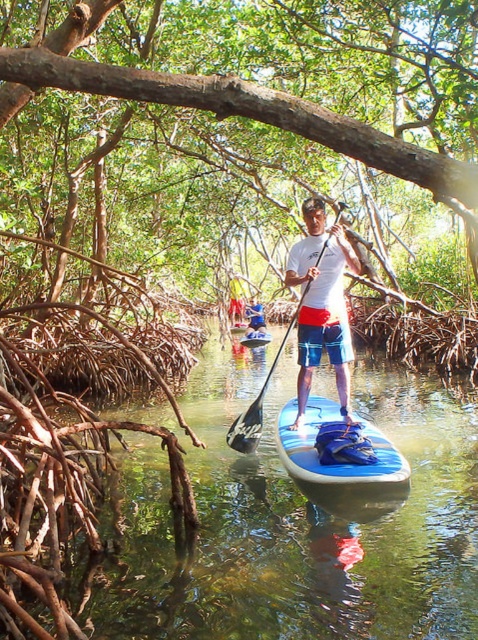
Question: Is black plastic paddle at center positioned before white matte paddle at center?

Choices:
 (A) yes
 (B) no

Answer: (A)

Question: Is white matte paddleboard at center behind blue inflatable paddleboard at center?

Choices:
 (A) yes
 (B) no

Answer: (A)

Question: Which point is farther to the camera?

Choices:
 (A) blue glossy paddleboard at center
 (B) white matte paddleboard at center
 (C) black plastic paddle at center
 (D) blue glossy canoe at center

Answer: (D)

Question: Considering the real-world distances, which object is farthest from the blue inflatable paddleboard at center?

Choices:
 (A) blue glossy paddleboard at center
 (B) white matte paddleboard at center
 (C) white matte paddle at center
 (D) black plastic paddle at center

Answer: (C)

Question: Considering the real-world distances, which object is farthest from the white matte paddle at center?

Choices:
 (A) blue glossy paddleboard at center
 (B) blue glossy canoe at center
 (C) black plastic paddle at center
 (D) white matte paddleboard at center

Answer: (D)

Question: In this image, where is black plastic paddle at center located relative to blue glossy canoe at center?

Choices:
 (A) right
 (B) left

Answer: (A)